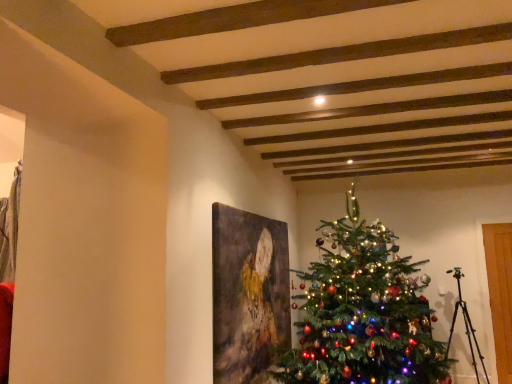
Question: Could green matte christmas tree at center be considered to be inside matte canvas painting at center?

Choices:
 (A) yes
 (B) no

Answer: (B)

Question: From a real-world perspective, is matte canvas painting at center on top of green matte christmas tree at center?

Choices:
 (A) yes
 (B) no

Answer: (B)

Question: From a real-world perspective, is matte canvas painting at center positioned under green matte christmas tree at center based on gravity?

Choices:
 (A) no
 (B) yes

Answer: (B)

Question: From the image's perspective, is matte canvas painting at center located beneath green matte christmas tree at center?

Choices:
 (A) no
 (B) yes

Answer: (B)

Question: Is matte canvas painting at center further to the viewer compared to green matte christmas tree at center?

Choices:
 (A) no
 (B) yes

Answer: (B)

Question: Can you confirm if matte canvas painting at center is thinner than green matte christmas tree at center?

Choices:
 (A) yes
 (B) no

Answer: (A)

Question: Does green matte christmas tree at center have a lesser height compared to matte canvas painting at center?

Choices:
 (A) no
 (B) yes

Answer: (A)

Question: From the image's perspective, does green matte christmas tree at center appear lower than matte canvas painting at center?

Choices:
 (A) no
 (B) yes

Answer: (A)

Question: Is green matte christmas tree at center positioned with its back to matte canvas painting at center?

Choices:
 (A) yes
 (B) no

Answer: (A)

Question: Considering the relative sizes of green matte christmas tree at center and matte canvas painting at center in the image provided, is green matte christmas tree at center thinner than matte canvas painting at center?

Choices:
 (A) no
 (B) yes

Answer: (A)

Question: From the image's perspective, would you say green matte christmas tree at center is positioned over matte canvas painting at center?

Choices:
 (A) no
 (B) yes

Answer: (B)

Question: From a real-world perspective, is green matte christmas tree at center positioned under matte canvas painting at center based on gravity?

Choices:
 (A) yes
 (B) no

Answer: (B)

Question: From the image's perspective, is matte canvas painting at center located above or below green matte christmas tree at center?

Choices:
 (A) above
 (B) below

Answer: (B)